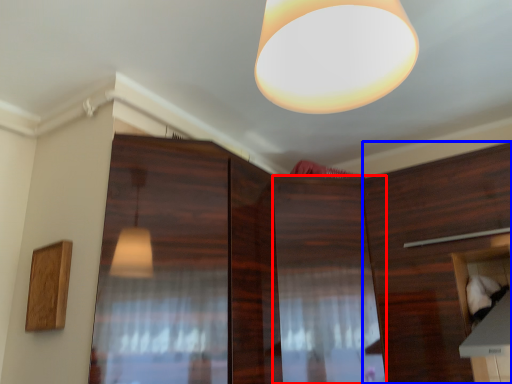
Question: Among these objects, which one is farthest to the camera, cabinetry (highlighted by a red box) or cabinetry (highlighted by a blue box)?

Choices:
 (A) cabinetry
 (B) cabinetry

Answer: (A)